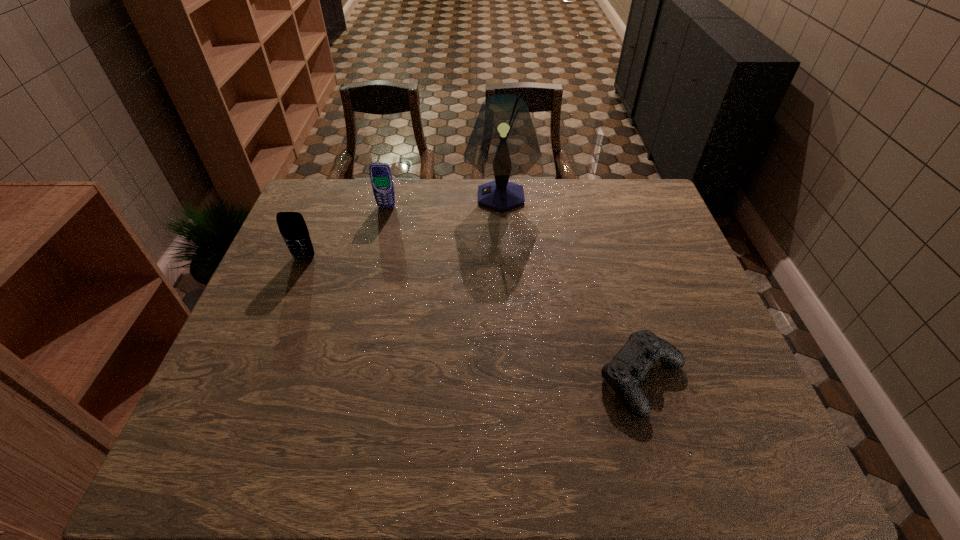
Image resolution: width=960 pixels, height=540 pixels. What are the coordinates of `vacant space located 0.070m on the base of the lampshade` in the screenshot? It's located at (444, 197).

Locate an element on the screen. free spot located 0.320m on the screen of the nearer cellular telephone is located at coordinates (265, 355).

Where is `vacant space located on the front-facing side of the right cellular telephone`? The height and width of the screenshot is (540, 960). vacant space located on the front-facing side of the right cellular telephone is located at coordinates (366, 294).

In order to click on vacant space positioned on the back of the rightmost object in this screenshot , I will do `click(612, 272)`.

Where is `lampshade at the far edge`? Image resolution: width=960 pixels, height=540 pixels. lampshade at the far edge is located at coordinates (503, 142).

You are a GUI agent. You are given a task and a screenshot of the screen. Output one action in this format:
    pyautogui.click(x=<x>, y=<y>)
    Task: Click on the cellular telephone located at the far edge
    
    Given the screenshot: What is the action you would take?
    pyautogui.click(x=381, y=177)

Where is `object that is at the left edge`? object that is at the left edge is located at coordinates (292, 226).

Identify the location of object present at the right edge. (629, 366).

Image resolution: width=960 pixels, height=540 pixels. What are the coordinates of `vacant space at the far edge of the desktop` in the screenshot? It's located at (417, 207).

I want to click on vacant area at the near edge of the desktop, so click(x=568, y=441).